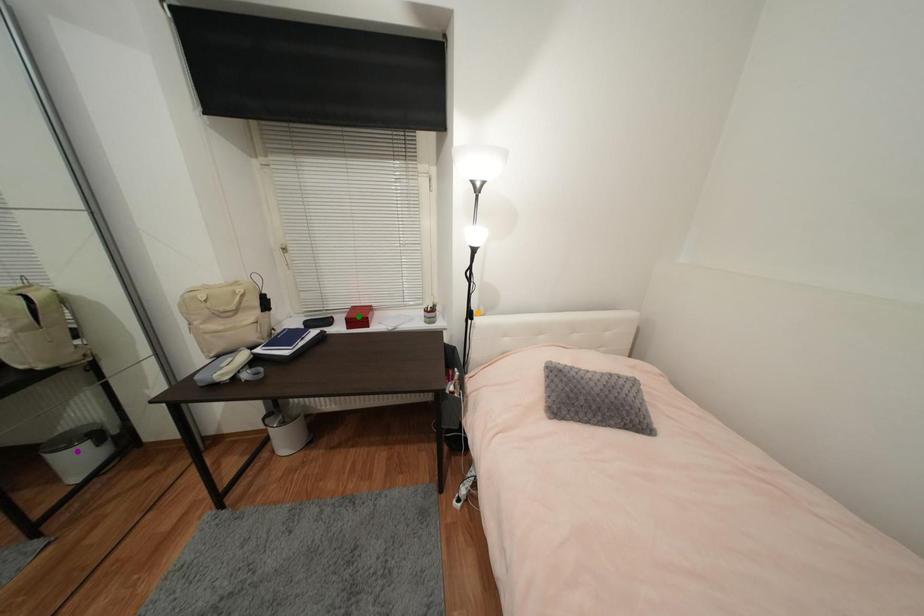
Order these from nearest to farthest:
A) green point
B) orange point
C) purple point

purple point < orange point < green point